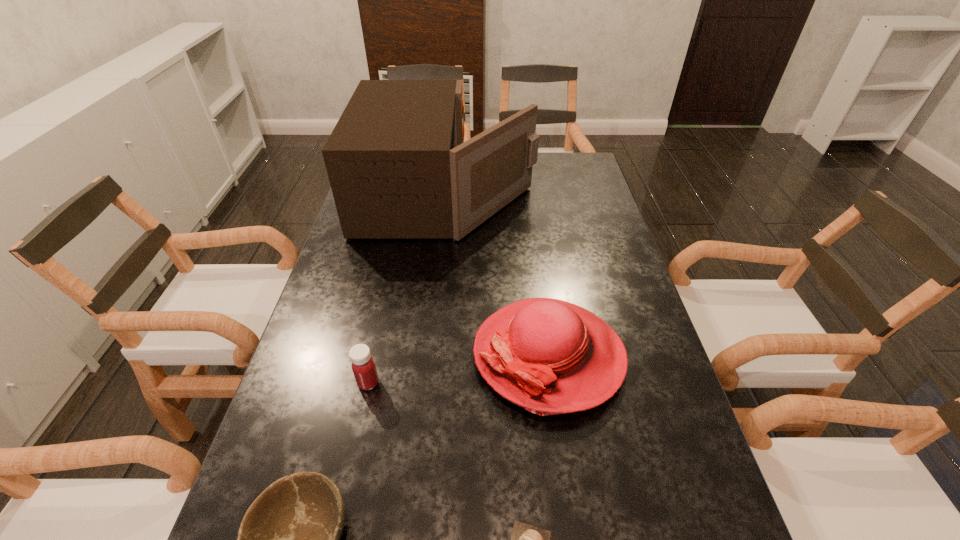
Identify the location of microwave oven that is at the left edge. pos(398,166).

Image resolution: width=960 pixels, height=540 pixels. What are the coordinates of `medicine that is at the left edge` in the screenshot? It's located at [363, 366].

Image resolution: width=960 pixels, height=540 pixels. Identify the location of object that is at the right edge. (549, 356).

Locate an element on the screen. The height and width of the screenshot is (540, 960). object located at the far left corner is located at coordinates (398, 166).

Image resolution: width=960 pixels, height=540 pixels. Find the location of `free region at the left edge of the desktop`. free region at the left edge of the desktop is located at coordinates (347, 247).

Where is `free region at the right edge of the desktop`? This screenshot has height=540, width=960. free region at the right edge of the desktop is located at coordinates (603, 204).

Where is `free space at the far right corner`? The height and width of the screenshot is (540, 960). free space at the far right corner is located at coordinates (552, 179).

The height and width of the screenshot is (540, 960). Identify the location of free space between the medicine and the tallest object. (408, 289).

Find the location of a particular element. empty location between the third shortest object and the tallest object is located at coordinates (408, 289).

Locate an element on the screen. The width and height of the screenshot is (960, 540). unoccupied position between the farthest object and the hat is located at coordinates (498, 275).